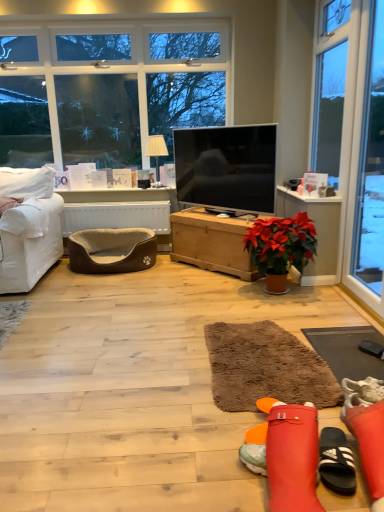
Question: Is matte black tv at center bigger or smaller than brown shaggy rug at lower right, which is counted as the 2th flat, starting from the left?

Choices:
 (A) big
 (B) small

Answer: (A)

Question: Choose the correct answer: Is matte black tv at center inside brown shaggy rug at lower right, the first flat viewed from the right, or outside it?

Choices:
 (A) outside
 (B) inside

Answer: (A)

Question: Considering the real-world distances, which object is closest to the brown plush pet bed at lower left?

Choices:
 (A) white fabric couch at left
 (B) brown shaggy rug at lower right, which is counted as the 2th flat, starting from the left
 (C) brown shaggy rug at center, the 2th flat from the right
 (D) white fabric lampshade at upper center
 (E) transparent glass door at right

Answer: (A)

Question: Which is farther from the white fabric lampshade at upper center?

Choices:
 (A) matte black tv at center
 (B) wooden chest at center, which is the 1th table from right to left
 (C) brown shaggy rug at center, the 2th flat from the right
 (D) brown shaggy rug at lower right, the first flat viewed from the right
 (E) brown plush pet bed at lower left

Answer: (D)